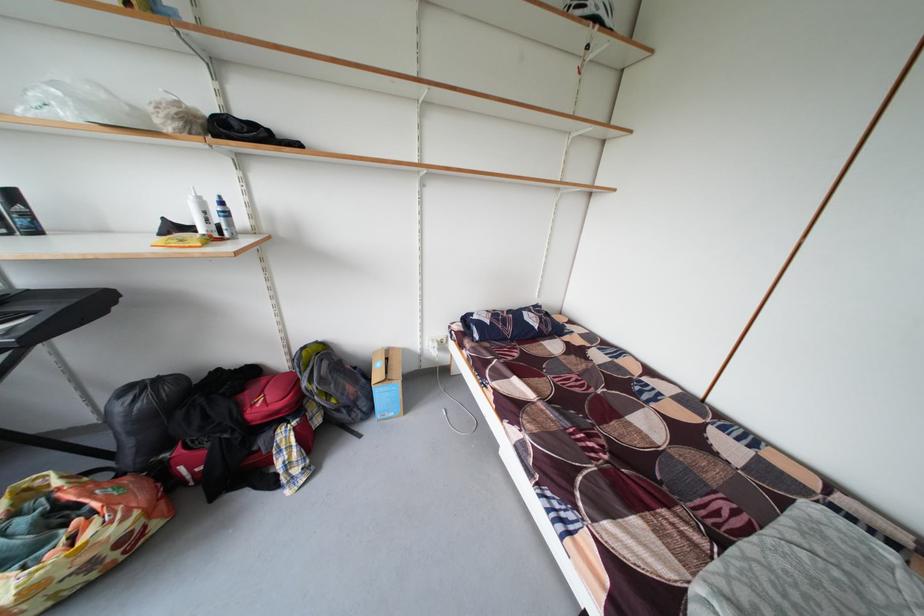
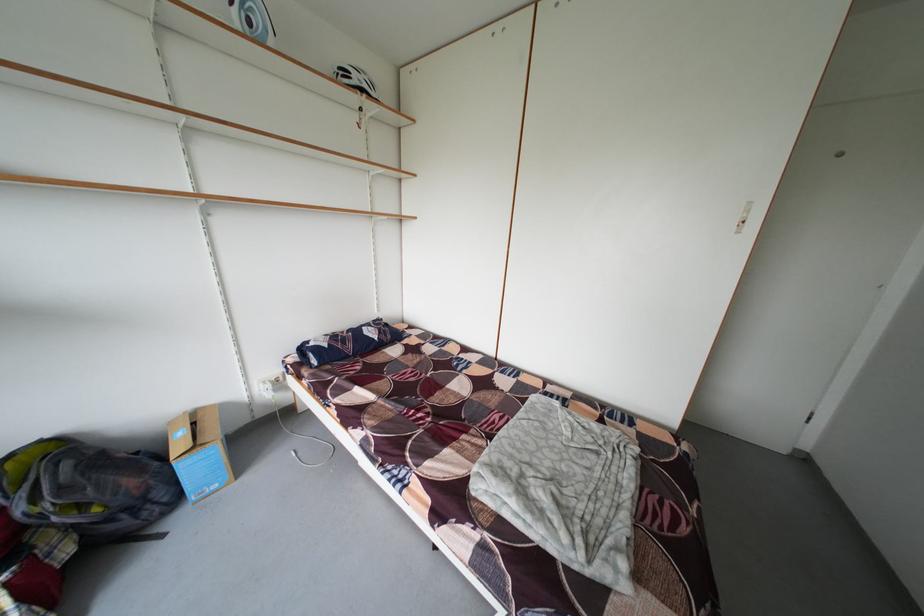
In the second image, find the point that corresponds to point (314, 390) in the first image.

(31, 515)